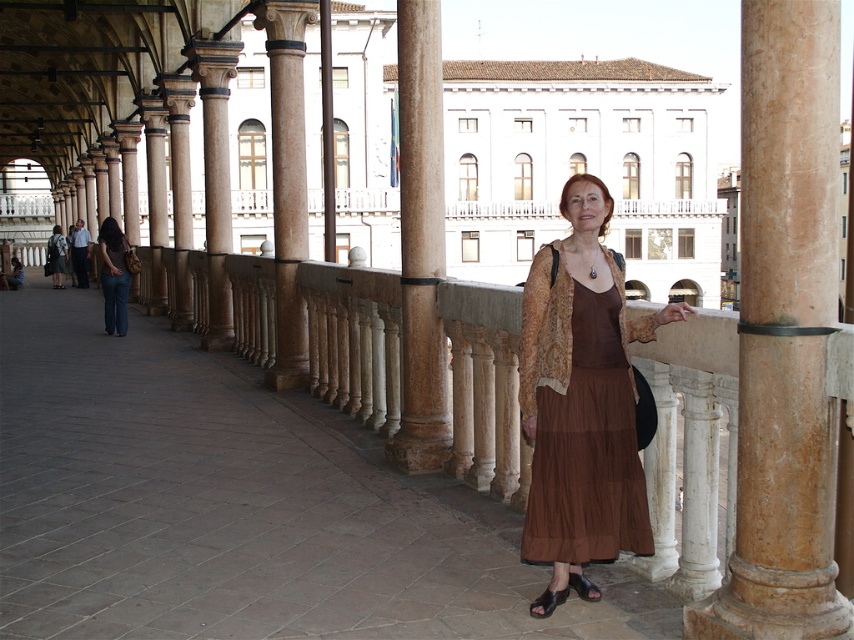
Between marble column at center and brown polished stone column at center, which one has more height?

With more height is brown polished stone column at center.

Based on the photo, does marble column at center have a smaller size compared to brown polished stone column at center?

Yes.

Does point (303, 209) lie behind point (331, 83)?

No, it is not.

The image size is (854, 640). I want to click on marble column at center, so click(x=287, y=182).

Based on the photo, can you confirm if brown fabric rail at center is positioned above brown marble column at center?

No, brown fabric rail at center is not above brown marble column at center.

Between point (342, 282) and point (433, 83), which one is positioned behind?

The point (342, 282) is behind.

Locate an element on the screen. brown fabric rail at center is located at coordinates (689, 449).

In the scene shown: Can you confirm if brown marble column at center is positioned above black leather sandal at lower center?

Yes, brown marble column at center is above black leather sandal at lower center.

Can you confirm if brown marble column at center is smaller than black leather sandal at lower center?

Actually, brown marble column at center might be larger than black leather sandal at lower center.

Who is more forward, (407,106) or (598,593)?

Point (598,593) is in front.

The image size is (854, 640). In order to click on brown marble column at center in this screenshot , I will do `click(420, 241)`.